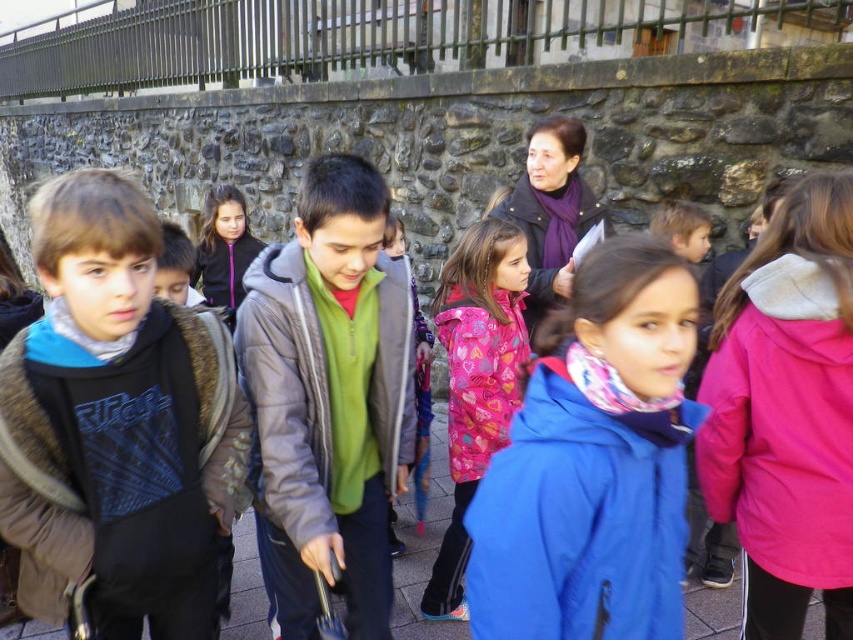
You are a photographer standing near the camera. You want to take a photo of the pink fleece jacket at center without moving the camera. Is the jacket within the camera lens range of 5 meters?

The pink fleece jacket at center and camera are 4.00 meters apart, so yes, the jacket is within the 5 meters camera lens range.

You are standing at the origin point of the image. Which object is located at the coordinates point [329,396]?

The green fleece jacket at center is located at point [329,396].